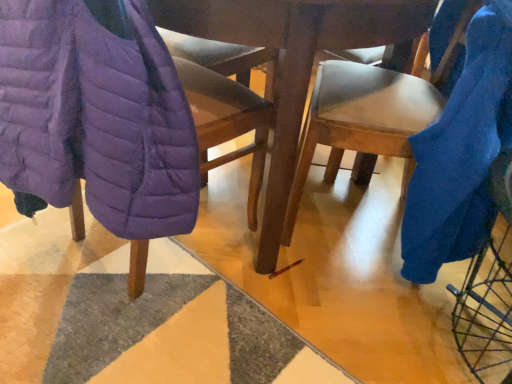
Find the location of a particular element. purple quilted jacket at left, which ranks as the second chair in right-to-left order is located at coordinates (228, 122).

Is blue fabric chair at right, the first chair when ordered from right to left, positioned with its back to blue fuzzy blanket at right, the first blanket positioned from the right?

Yes, blue fabric chair at right, the first chair when ordered from right to left, is positioned with its back facing blue fuzzy blanket at right, the first blanket positioned from the right.

Does point (340, 75) lie behind point (442, 49)?

That is False.

Based on the photo, from a real-world perspective, who is located higher, blue fabric chair at right, positioned as the 2th chair in left-to-right order, or blue fuzzy blanket at right, which is the 2th blanket from left to right?

In real-world perspective, blue fuzzy blanket at right, which is the 2th blanket from left to right, is above.

Are blue fabric chair at right, the first chair when ordered from right to left, and blue fuzzy blanket at right, the first blanket positioned from the right, far apart?

blue fabric chair at right, the first chair when ordered from right to left, is near blue fuzzy blanket at right, the first blanket positioned from the right, not far away.

Does purple quilted jacket at left, the 1th chair positioned from the left, turn towards purple quilted jacket at left, positioned as the first blanket in left-to-right order?

Yes, purple quilted jacket at left, the 1th chair positioned from the left, is facing purple quilted jacket at left, positioned as the first blanket in left-to-right order.

Which is behind, point (195, 103) or point (9, 66)?

Point (195, 103)

From the image's perspective, which chair is the 2nd one below the purple quilted jacket at left, positioned as the first blanket in left-to-right order? Please provide its 2D coordinates.

[(228, 122)]

Does purple quilted jacket at left, which ranks as the second chair in right-to-left order, appear on the left side of purple quilted jacket at left, positioned as the first blanket in left-to-right order?

In fact, purple quilted jacket at left, which ranks as the second chair in right-to-left order, is to the right of purple quilted jacket at left, positioned as the first blanket in left-to-right order.

From a real-world perspective, is blue fuzzy blanket at right, which is the 2th blanket from left to right, positioned above or below blue fabric chair at right, positioned as the 2th chair in left-to-right order?

blue fuzzy blanket at right, which is the 2th blanket from left to right, is above blue fabric chair at right, positioned as the 2th chair in left-to-right order.

Where is `chair that is the 1st one when counting leftward from the blue fuzzy blanket at right, which is the 2th blanket from left to right`? The image size is (512, 384). chair that is the 1st one when counting leftward from the blue fuzzy blanket at right, which is the 2th blanket from left to right is located at coordinates (369, 114).

Is blue fuzzy blanket at right, the first blanket positioned from the right, next to blue fabric chair at right, positioned as the 2th chair in left-to-right order, and touching it?

blue fuzzy blanket at right, the first blanket positioned from the right, and blue fabric chair at right, positioned as the 2th chair in left-to-right order, are clearly separated.

Consider the image. Who is taller, blue fuzzy blanket at right, which is the 2th blanket from left to right, or blue fabric chair at right, the first chair when ordered from right to left?

blue fabric chair at right, the first chair when ordered from right to left, is taller.

From a real-world perspective, is purple quilted jacket at left, which is the 2th blanket in right-to-left order, positioned above or below purple quilted jacket at left, the 1th chair positioned from the left?

purple quilted jacket at left, which is the 2th blanket in right-to-left order, is situated higher than purple quilted jacket at left, the 1th chair positioned from the left, in the real world.

Based on the photo, is purple quilted jacket at left, which is the 2th blanket in right-to-left order, next to purple quilted jacket at left, the 1th chair positioned from the left?

No, purple quilted jacket at left, which is the 2th blanket in right-to-left order, is not with purple quilted jacket at left, the 1th chair positioned from the left.

Locate an element on the screen. The image size is (512, 384). the 2nd chair below the purple quilted jacket at left, positioned as the first blanket in left-to-right order (from the image's perspective) is located at coordinates (228, 122).

Between purple quilted jacket at left, positioned as the first blanket in left-to-right order, and purple quilted jacket at left, which ranks as the second chair in right-to-left order, which one is positioned in front?

Positioned in front is purple quilted jacket at left, positioned as the first blanket in left-to-right order.

Which is less distant, (426, 85) or (208, 86)?

The point (208, 86) is in front.

Is blue fabric chair at right, positioned as the 2th chair in left-to-right order, to the right of purple quilted jacket at left, which ranks as the second chair in right-to-left order, from the viewer's perspective?

Yes, blue fabric chair at right, positioned as the 2th chair in left-to-right order, is to the right of purple quilted jacket at left, which ranks as the second chair in right-to-left order.

From the image's perspective, relative to purple quilted jacket at left, the 1th chair positioned from the left, is blue fabric chair at right, the first chair when ordered from right to left, above or below?

Based on their image positions, blue fabric chair at right, the first chair when ordered from right to left, is located above purple quilted jacket at left, the 1th chair positioned from the left.

Considering the relative sizes of blue fabric chair at right, positioned as the 2th chair in left-to-right order, and purple quilted jacket at left, the 1th chair positioned from the left, in the image provided, is blue fabric chair at right, positioned as the 2th chair in left-to-right order, taller than purple quilted jacket at left, the 1th chair positioned from the left,?

Correct, blue fabric chair at right, positioned as the 2th chair in left-to-right order, is much taller as purple quilted jacket at left, the 1th chair positioned from the left.

Measure the distance from purple quilted jacket at left, which ranks as the second chair in right-to-left order, to blue fuzzy blanket at right, which is the 2th blanket from left to right.

purple quilted jacket at left, which ranks as the second chair in right-to-left order, and blue fuzzy blanket at right, which is the 2th blanket from left to right, are 18.91 inches apart.

Does purple quilted jacket at left, which ranks as the second chair in right-to-left order, have a lesser width compared to blue fuzzy blanket at right, which is the 2th blanket from left to right?

No.

Based on the photo, who is more distant, purple quilted jacket at left, the 1th chair positioned from the left, or blue fuzzy blanket at right, the first blanket positioned from the right?

blue fuzzy blanket at right, the first blanket positioned from the right.

Is purple quilted jacket at left, which ranks as the second chair in right-to-left order, oriented towards blue fuzzy blanket at right, the first blanket positioned from the right?

No, purple quilted jacket at left, which ranks as the second chair in right-to-left order, is not oriented towards blue fuzzy blanket at right, the first blanket positioned from the right.

From the picture: From the image's perspective, is blue fuzzy blanket at right, which is the 2th blanket from left to right, located above purple quilted jacket at left, which is the 2th blanket in right-to-left order?

Incorrect, from the image's perspective, blue fuzzy blanket at right, which is the 2th blanket from left to right, is lower than purple quilted jacket at left, which is the 2th blanket in right-to-left order.

Is blue fuzzy blanket at right, which is the 2th blanket from left to right, turned away from purple quilted jacket at left, which is the 2th blanket in right-to-left order?

That's not correct — blue fuzzy blanket at right, which is the 2th blanket from left to right, is not looking away from purple quilted jacket at left, which is the 2th blanket in right-to-left order.

Is blue fuzzy blanket at right, which is the 2th blanket from left to right, thinner than purple quilted jacket at left, which is the 2th blanket in right-to-left order?

No.

Is point (462, 78) positioned in front of point (12, 77)?

No, it is behind (12, 77).

Identify the location of chair that is the 1st one when counting leftward from the blue fuzzy blanket at right, which is the 2th blanket from left to right. (369, 114).

Where is `blanket in front of the purple quilted jacket at left, which ranks as the second chair in right-to-left order`? Image resolution: width=512 pixels, height=384 pixels. blanket in front of the purple quilted jacket at left, which ranks as the second chair in right-to-left order is located at coordinates (96, 117).

Which object lies nearer to the anchor point purple quilted jacket at left, which is the 2th blanket in right-to-left order, blue fabric chair at right, positioned as the 2th chair in left-to-right order, or blue fuzzy blanket at right, the first blanket positioned from the right?

Among the two, blue fabric chair at right, positioned as the 2th chair in left-to-right order, is located nearer to purple quilted jacket at left, which is the 2th blanket in right-to-left order.

Looking at the image, which one is located further to purple quilted jacket at left, the 1th chair positioned from the left, blue fabric chair at right, positioned as the 2th chair in left-to-right order, or purple quilted jacket at left, positioned as the first blanket in left-to-right order?

blue fabric chair at right, positioned as the 2th chair in left-to-right order, is positioned further to the anchor purple quilted jacket at left, the 1th chair positioned from the left.

Looking at the image, which one is located closer to blue fabric chair at right, positioned as the 2th chair in left-to-right order, purple quilted jacket at left, which ranks as the second chair in right-to-left order, or purple quilted jacket at left, which is the 2th blanket in right-to-left order?

Among the two, purple quilted jacket at left, which ranks as the second chair in right-to-left order, is located nearer to blue fabric chair at right, positioned as the 2th chair in left-to-right order.

Looking at the image, which one is located closer to blue fuzzy blanket at right, which is the 2th blanket from left to right, purple quilted jacket at left, which is the 2th blanket in right-to-left order, or blue fabric chair at right, positioned as the 2th chair in left-to-right order?

blue fabric chair at right, positioned as the 2th chair in left-to-right order.

From the image, which object appears to be farther from purple quilted jacket at left, which ranks as the second chair in right-to-left order, blue fuzzy blanket at right, which is the 2th blanket from left to right, or purple quilted jacket at left, positioned as the first blanket in left-to-right order?

Among the two, blue fuzzy blanket at right, which is the 2th blanket from left to right, is located further to purple quilted jacket at left, which ranks as the second chair in right-to-left order.

Which object lies further to the anchor point blue fuzzy blanket at right, the first blanket positioned from the right, blue fabric chair at right, positioned as the 2th chair in left-to-right order, or purple quilted jacket at left, which is the 2th blanket in right-to-left order?

purple quilted jacket at left, which is the 2th blanket in right-to-left order, is further to blue fuzzy blanket at right, the first blanket positioned from the right.

Looking at the image, which one is located closer to purple quilted jacket at left, the 1th chair positioned from the left, blue fabric chair at right, the first chair when ordered from right to left, or blue fuzzy blanket at right, the first blanket positioned from the right?

blue fabric chair at right, the first chair when ordered from right to left, is positioned closer to the anchor purple quilted jacket at left, the 1th chair positioned from the left.

Which object lies further to the anchor point purple quilted jacket at left, which is the 2th blanket in right-to-left order, blue fuzzy blanket at right, the first blanket positioned from the right, or purple quilted jacket at left, which ranks as the second chair in right-to-left order?

The object further to purple quilted jacket at left, which is the 2th blanket in right-to-left order, is blue fuzzy blanket at right, the first blanket positioned from the right.

Locate an element on the screen. chair located between purple quilted jacket at left, positioned as the first blanket in left-to-right order, and blue fabric chair at right, positioned as the 2th chair in left-to-right order, in the left-right direction is located at coordinates (228, 122).

Where is `chair between purple quilted jacket at left, the 1th chair positioned from the left, and blue fuzzy blanket at right, which is the 2th blanket from left to right, from left to right`? chair between purple quilted jacket at left, the 1th chair positioned from the left, and blue fuzzy blanket at right, which is the 2th blanket from left to right, from left to right is located at coordinates (369, 114).